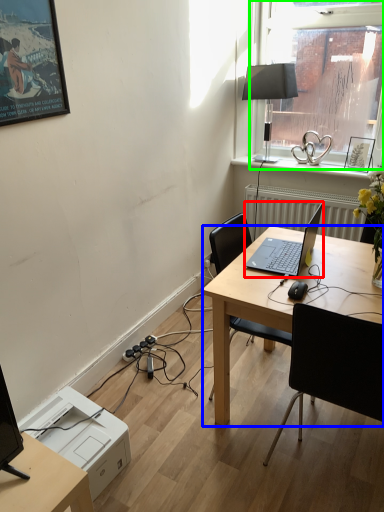
Question: Which object is the closest to the laptop (highlighted by a red box)? Choose among these: desk (highlighted by a blue box) or window (highlighted by a green box).

Choices:
 (A) desk
 (B) window

Answer: (A)